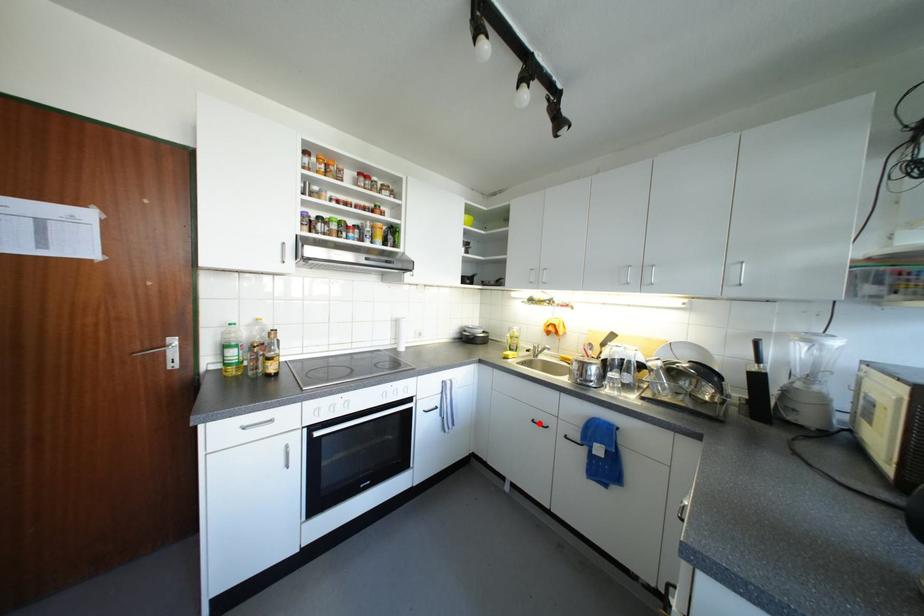
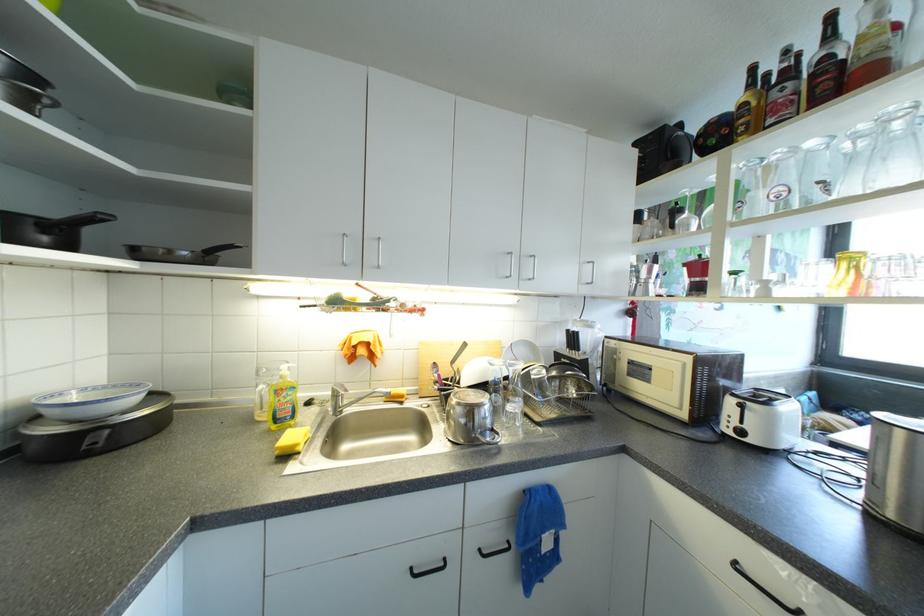
Locate, in the second image, the point that corresponds to the highlighted location in the first image.

(417, 573)